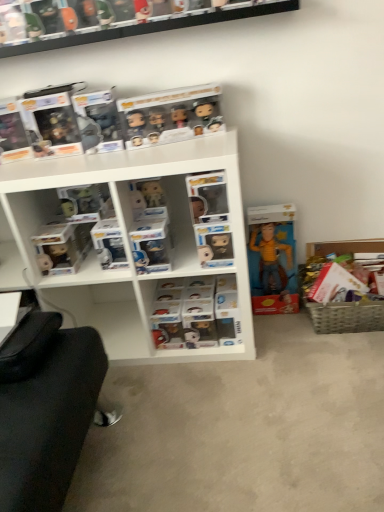
Question: Does clear plastic figures at center have a greater height compared to woven basket at lower right?

Choices:
 (A) no
 (B) yes

Answer: (A)

Question: Is the position of clear plastic figures at center less distant than that of woven basket at lower right?

Choices:
 (A) no
 (B) yes

Answer: (A)

Question: Can you confirm if clear plastic figures at center is bigger than woven basket at lower right?

Choices:
 (A) yes
 (B) no

Answer: (A)

Question: From the image's perspective, does clear plastic figures at center appear higher than woven basket at lower right?

Choices:
 (A) yes
 (B) no

Answer: (B)

Question: From the image's perspective, is clear plastic figures at center located beneath woven basket at lower right?

Choices:
 (A) yes
 (B) no

Answer: (A)

Question: Is clear plastic figures at center facing away from woven basket at lower right?

Choices:
 (A) no
 (B) yes

Answer: (A)

Question: Can you confirm if matte black figurine at left, which is the 1th toy from left to right, is bigger than white plastic shelf at center, the second shelf in the top-to-bottom sequence?

Choices:
 (A) yes
 (B) no

Answer: (B)

Question: From a real-world perspective, does matte black figurine at left, which is the 1th toy from left to right, sit lower than white plastic shelf at center, which appears as the first shelf when ordered from the bottom?

Choices:
 (A) no
 (B) yes

Answer: (A)

Question: From a real-world perspective, does matte black figurine at left, positioned as the 2th toy in right-to-left order, stand above white plastic shelf at center, the second shelf in the top-to-bottom sequence?

Choices:
 (A) no
 (B) yes

Answer: (B)

Question: Is matte black figurine at left, positioned as the 2th toy in right-to-left order, positioned far away from white plastic shelf at center, which appears as the first shelf when ordered from the bottom?

Choices:
 (A) no
 (B) yes

Answer: (A)

Question: Is matte black figurine at left, which is the 1th toy from left to right, directly adjacent to white plastic shelf at center, which appears as the first shelf when ordered from the bottom?

Choices:
 (A) no
 (B) yes

Answer: (A)

Question: Could white plastic shelf at center, which appears as the first shelf when ordered from the bottom, be considered to be inside matte black figurine at left, which is the 1th toy from left to right?

Choices:
 (A) no
 (B) yes

Answer: (A)

Question: From a real-world perspective, does woven basket at lower right sit lower than matte black figurine at left, positioned as the 2th toy in right-to-left order?

Choices:
 (A) yes
 (B) no

Answer: (A)